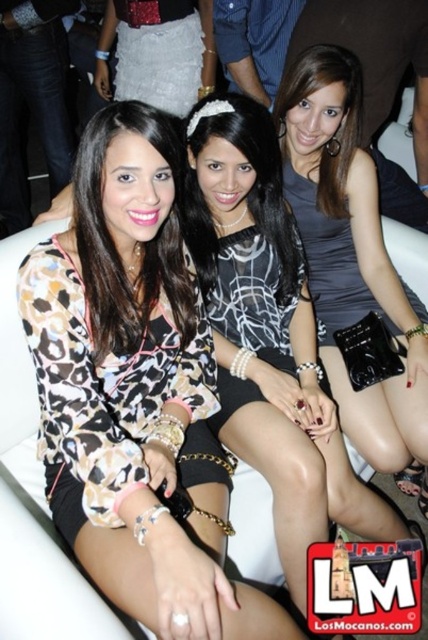
Question: Which point is closer to the camera taking this photo?

Choices:
 (A) [x=148, y=305]
 (B) [x=223, y=132]
 (C) [x=315, y=52]
 (D) [x=154, y=316]

Answer: (B)

Question: Can you confirm if gray matte dress at center is positioned to the left of leopard print fabric dress at center?

Choices:
 (A) no
 (B) yes

Answer: (A)

Question: Which of the following is the farthest from the observer?

Choices:
 (A) leopard print fabric dress at center
 (B) gray matte dress at center
 (C) leopard print blouse at center
 (D) silver metallic skirt at upper left

Answer: (D)

Question: Does leopard print blouse at center have a larger size compared to leopard print fabric dress at center?

Choices:
 (A) yes
 (B) no

Answer: (A)

Question: Which object is closer to the camera taking this photo?

Choices:
 (A) black and white printed blouse at center
 (B) leopard print fabric dress at center
 (C) silver metallic skirt at upper left

Answer: (B)

Question: Does gray matte dress at center appear under leopard print fabric dress at center?

Choices:
 (A) yes
 (B) no

Answer: (B)